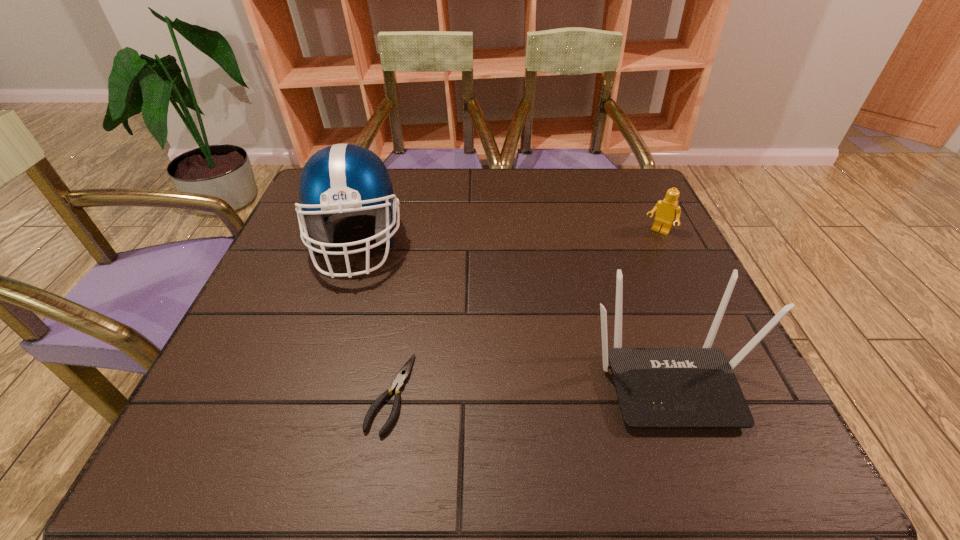
In order to click on free spot between the third shortest object and the third tallest object in this screenshot , I will do `click(663, 306)`.

Identify the location of free space between the Lego and the second tallest object. The height and width of the screenshot is (540, 960). (663, 306).

Find the location of a particular element. vacant area that lies between the third shortest object and the tallest object is located at coordinates (512, 311).

Find the location of a particular element. This screenshot has height=540, width=960. unoccupied area between the football helmet and the shortest object is located at coordinates (373, 319).

Locate which object is the third closest to the router. Please provide its 2D coordinates. Your answer should be formatted as a tuple, i.e. [(x, y)], where the tuple contains the x and y coordinates of a point satisfying the conditions above.

[(343, 180)]

You are a GUI agent. You are given a task and a screenshot of the screen. Output one action in this format:
    pyautogui.click(x=<x>, y=<y>)
    Task: Click on the object that is the third closest one to the second tallest object
    The width and height of the screenshot is (960, 540).
    Given the screenshot: What is the action you would take?
    pyautogui.click(x=343, y=180)